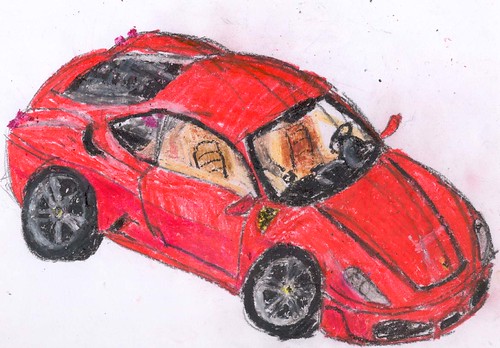
This screenshot has width=500, height=348. Find the location of `hood`. hood is located at coordinates (391, 211).